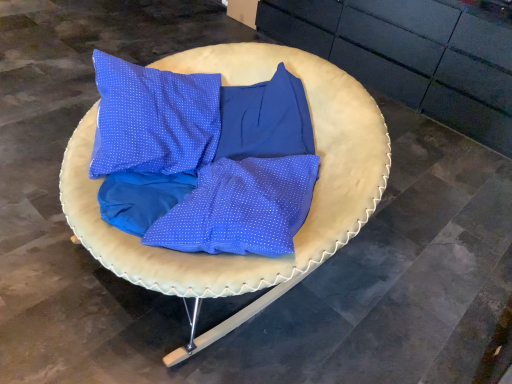
Describe the element at coordinates (311, 203) in the screenshot. This screenshot has width=512, height=384. I see `blue dotted fabric at center` at that location.

What is the approximate height of blue dotted fabric at center?

It is 21.80 inches.

Measure the distance between point (230, 289) and camera.

Point (230, 289) and camera are 3.57 feet apart from each other.

You are a GUI agent. You are given a task and a screenshot of the screen. Output one action in this format:
    pyautogui.click(x=<x>, y=<y>)
    Task: Click on the blue dotted fabric at center
    
    Given the screenshot: What is the action you would take?
    pyautogui.click(x=311, y=203)

Locate an element on the screen. blue dotted fabric at center is located at coordinates (311, 203).